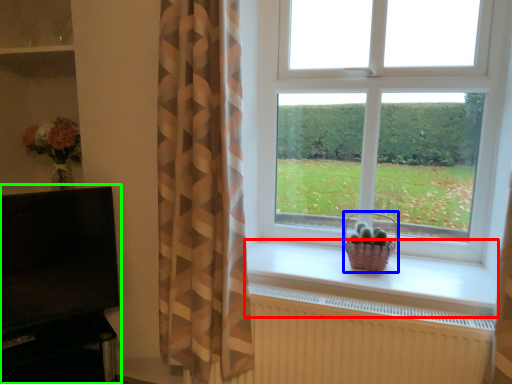
Question: Estimate the real-world distances between objects in this image. Which object is closer to window sill (highlighted by a red box), basket (highlighted by a blue box) or entertainment center (highlighted by a green box)?

Choices:
 (A) basket
 (B) entertainment center

Answer: (A)